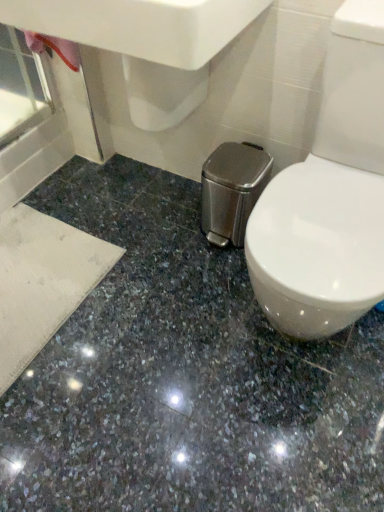
Find the location of a particular element. vacant space underneath white glossy sink at upper center (from a real-world perspective) is located at coordinates (144, 210).